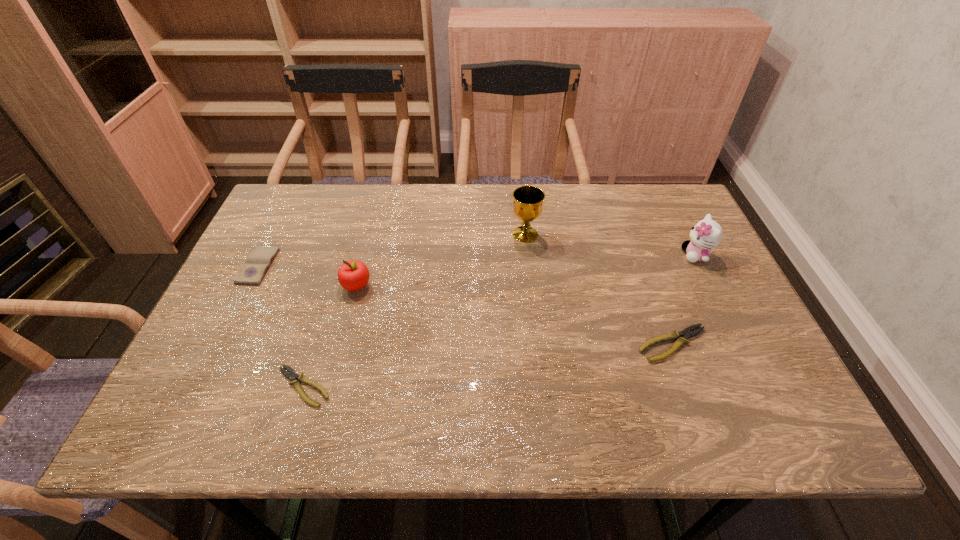
I want to click on vacant region between the second tallest object and the third object from right to left, so click(x=611, y=245).

You are a GUI agent. You are given a task and a screenshot of the screen. Output one action in this format:
    pyautogui.click(x=<x>, y=<y>)
    Task: Click on the vacant point located between the shorter pliers and the fifth object from left to right
    The width and height of the screenshot is (960, 540).
    Given the screenshot: What is the action you would take?
    pyautogui.click(x=488, y=365)

Where is `free space between the third shortest object and the taller pliers`? Image resolution: width=960 pixels, height=540 pixels. free space between the third shortest object and the taller pliers is located at coordinates (466, 305).

Find the location of a particular element. This screenshot has height=540, width=960. free space between the diary and the kitten is located at coordinates (x=477, y=261).

Identify the location of unoccupied area between the chalice and the third tallest object. (441, 260).

Identify the location of vacant space in between the second nearest object and the third tallest object. The width and height of the screenshot is (960, 540). (515, 315).

At what (x,y) coordinates should I click in order to perform the action: click on empty location between the kitten and the fourth tallest object. Please return your answer as a coordinate pair (x, y). The height and width of the screenshot is (540, 960). Looking at the image, I should click on (477, 261).

Find the location of a particular element. free space between the fourth shortest object and the nearer pliers is located at coordinates (330, 336).

At what (x,y) coordinates should I click in order to perform the action: click on vacant point located between the kitten and the third object from right to left. Please return your answer as a coordinate pair (x, y). The image size is (960, 540). Looking at the image, I should click on (611, 245).

The image size is (960, 540). I want to click on vacant area that lies between the nearer pliers and the chalice, so pyautogui.click(x=415, y=310).